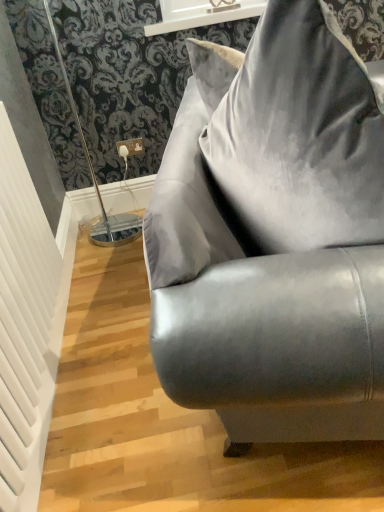
Question: Is white glossy window sill at upper center taller than satin gray couch at center?

Choices:
 (A) yes
 (B) no

Answer: (B)

Question: Is white glossy window sill at upper center in front of satin gray couch at center?

Choices:
 (A) no
 (B) yes

Answer: (A)

Question: From a real-world perspective, is white glossy window sill at upper center over satin gray couch at center?

Choices:
 (A) yes
 (B) no

Answer: (A)

Question: From a real-world perspective, is white glossy window sill at upper center beneath satin gray couch at center?

Choices:
 (A) no
 (B) yes

Answer: (A)

Question: From the image's perspective, is white glossy window sill at upper center on satin gray couch at center?

Choices:
 (A) yes
 (B) no

Answer: (A)

Question: From the image's perspective, is white glossy window sill at upper center below satin gray couch at center?

Choices:
 (A) no
 (B) yes

Answer: (A)

Question: From a real-world perspective, is white textured radiator at left physically above white glossy window sill at upper center?

Choices:
 (A) no
 (B) yes

Answer: (A)

Question: From the image's perspective, is white textured radiator at left located beneath white glossy window sill at upper center?

Choices:
 (A) yes
 (B) no

Answer: (A)

Question: Is white textured radiator at left thinner than white glossy window sill at upper center?

Choices:
 (A) no
 (B) yes

Answer: (B)

Question: Can you confirm if white textured radiator at left is wider than white glossy window sill at upper center?

Choices:
 (A) no
 (B) yes

Answer: (A)

Question: Is white textured radiator at left beside white glossy window sill at upper center?

Choices:
 (A) yes
 (B) no

Answer: (B)

Question: Is white textured radiator at left oriented away from white glossy window sill at upper center?

Choices:
 (A) no
 (B) yes

Answer: (A)

Question: Is white glossy window sill at upper center positioned far away from white textured radiator at left?

Choices:
 (A) no
 (B) yes

Answer: (B)